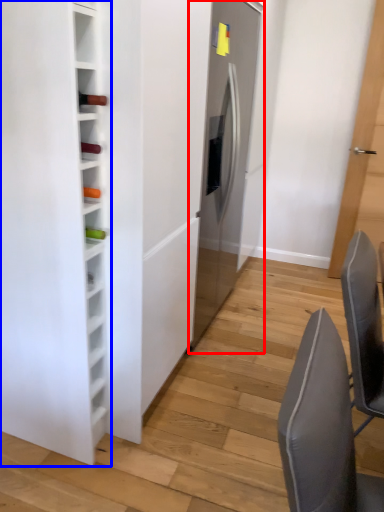
Question: Which object appears closest to the camera in this image, fridge (highlighted by a red box) or furniture (highlighted by a blue box)?

Choices:
 (A) fridge
 (B) furniture

Answer: (B)